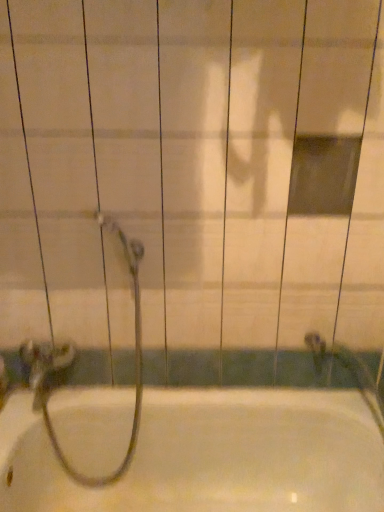
Question: Does white glossy bathtub at center have a larger size compared to metallic silver garden hose at lower left?

Choices:
 (A) no
 (B) yes

Answer: (B)

Question: Does white glossy bathtub at center appear on the right side of metallic silver garden hose at lower left?

Choices:
 (A) yes
 (B) no

Answer: (A)

Question: Does white glossy bathtub at center have a greater height compared to metallic silver garden hose at lower left?

Choices:
 (A) yes
 (B) no

Answer: (B)

Question: Can you see white glossy bathtub at center touching metallic silver garden hose at lower left?

Choices:
 (A) yes
 (B) no

Answer: (B)

Question: Could you tell me if white glossy bathtub at center is turned towards metallic silver garden hose at lower left?

Choices:
 (A) no
 (B) yes

Answer: (A)

Question: Is metallic silver garden hose at lower left surrounded by white glossy bathtub at center?

Choices:
 (A) yes
 (B) no

Answer: (A)

Question: Is white glossy bathtub at center inside metallic silver garden hose at lower left?

Choices:
 (A) yes
 (B) no

Answer: (B)

Question: Would you consider metallic silver garden hose at lower left to be distant from white glossy bathtub at center?

Choices:
 (A) yes
 (B) no

Answer: (B)

Question: Is the depth of metallic silver garden hose at lower left greater than that of white glossy bathtub at center?

Choices:
 (A) no
 (B) yes

Answer: (B)

Question: Considering the relative sizes of metallic silver garden hose at lower left and white glossy bathtub at center in the image provided, is metallic silver garden hose at lower left thinner than white glossy bathtub at center?

Choices:
 (A) no
 (B) yes

Answer: (B)

Question: Is metallic silver garden hose at lower left directly adjacent to white glossy bathtub at center?

Choices:
 (A) yes
 (B) no

Answer: (B)

Question: Does metallic silver garden hose at lower left have a smaller size compared to white glossy bathtub at center?

Choices:
 (A) yes
 (B) no

Answer: (A)

Question: Would you say metallic silver garden hose at lower left is inside or outside white glossy bathtub at center?

Choices:
 (A) outside
 (B) inside

Answer: (B)